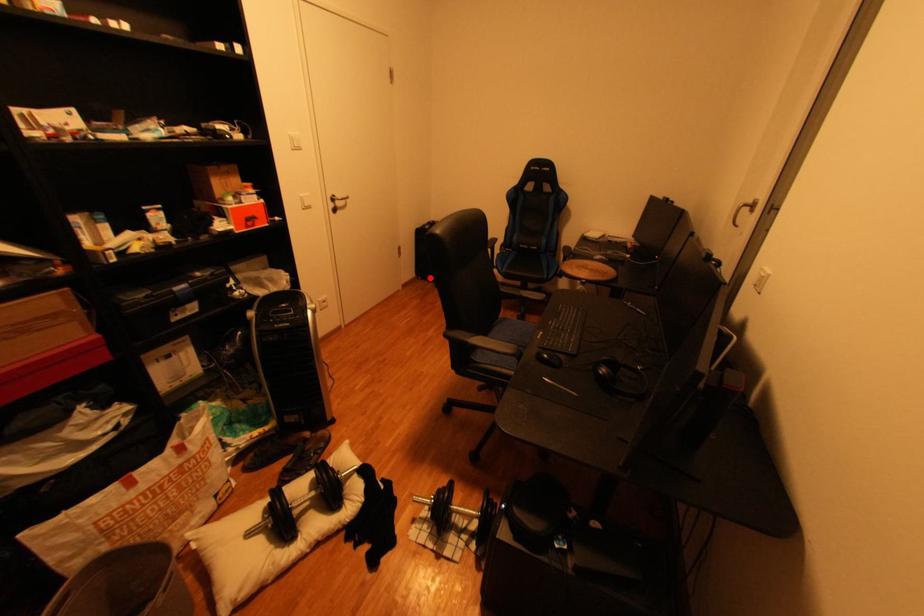
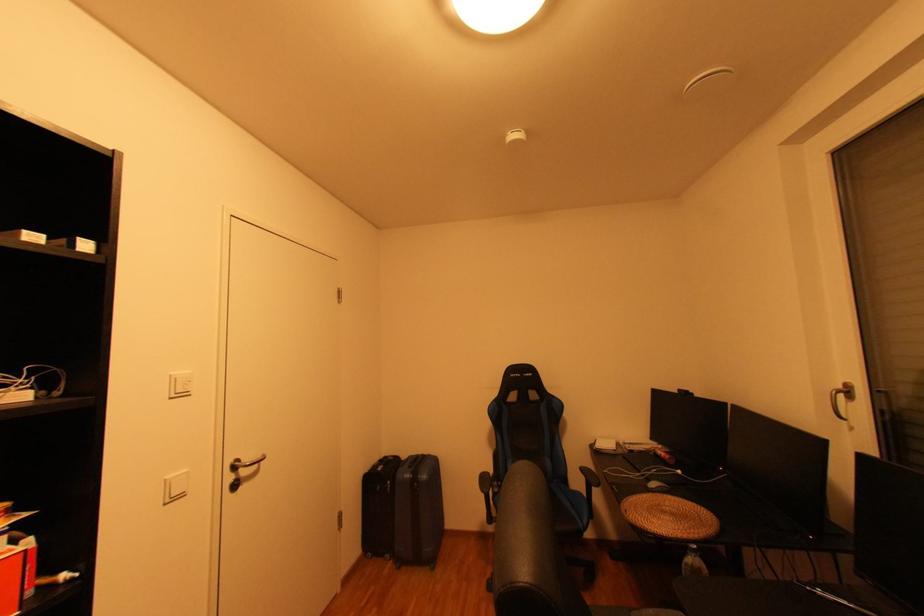
Question: A red point is marked in image1. In image2, is the corresponding 3D point closer to the camera or farther? Reply with the corresponding letter.

Choices:
 (A) The corresponding 3D point is closer.
 (B) The corresponding 3D point is farther.

Answer: (B)